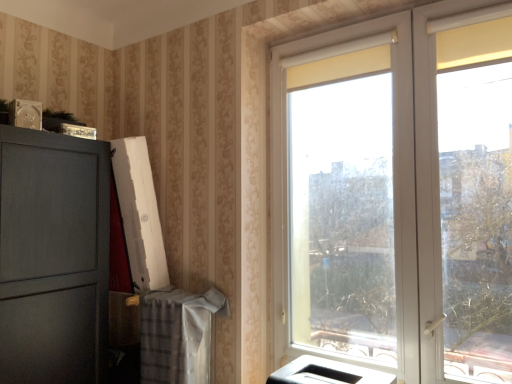
Question: Is white glossy printer at lower center wider or thinner than white plastic window at right?

Choices:
 (A) wide
 (B) thin

Answer: (B)

Question: Considering their positions, is white glossy printer at lower center located in front of or behind white plastic window at right?

Choices:
 (A) behind
 (B) front

Answer: (A)

Question: From a real-world perspective, relative to white plastic window at right, is white glossy printer at lower center vertically above or below?

Choices:
 (A) below
 (B) above

Answer: (A)

Question: Visually, is white plastic window at right positioned to the left or to the right of white glossy printer at lower center?

Choices:
 (A) right
 (B) left

Answer: (A)

Question: In terms of width, does white plastic window at right look wider or thinner when compared to white glossy printer at lower center?

Choices:
 (A) wide
 (B) thin

Answer: (A)

Question: Is point click(401, 294) positioned closer to the camera than point click(295, 369)?

Choices:
 (A) closer
 (B) farther

Answer: (A)

Question: In terms of size, does white plastic window at right appear bigger or smaller than white glossy printer at lower center?

Choices:
 (A) big
 (B) small

Answer: (A)